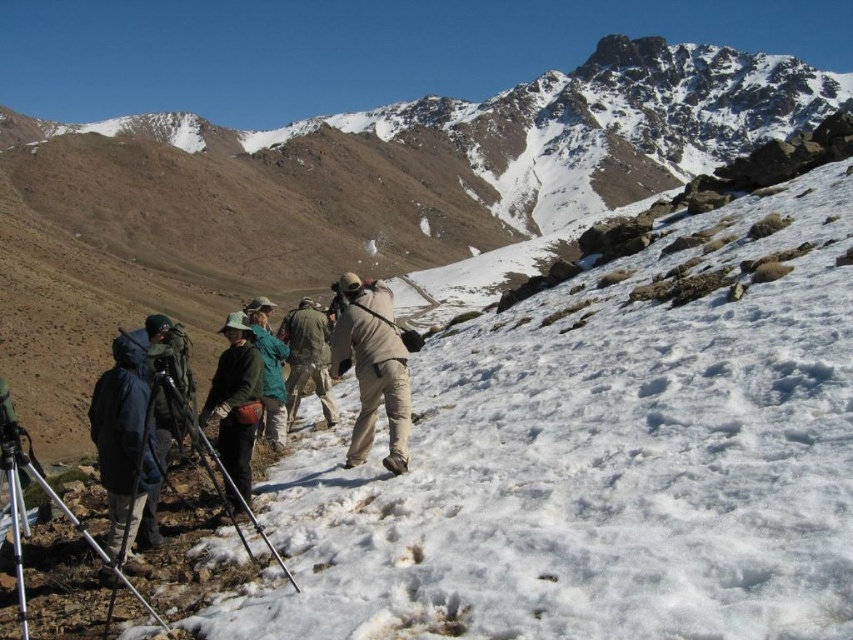
Question: Considering the real-world distances, which object is closest to the tan fabric backpack at center?

Choices:
 (A) silver metallic tripod at lower left
 (B) camouflage fabric jacket at center

Answer: (B)

Question: Does brushed metal backpack at lower left come behind silver metallic tripod at lower left?

Choices:
 (A) yes
 (B) no

Answer: (A)

Question: Can you confirm if brushed metal backpack at lower left is bigger than teal fabric jacket at center?

Choices:
 (A) no
 (B) yes

Answer: (B)

Question: Which is nearer to the silver metallic tripod at lower left?

Choices:
 (A) teal fabric jacket at center
 (B) camouflage fabric jacket at center
 (C) tan fabric backpack at center

Answer: (A)

Question: Which of the following is the farthest from the observer?

Choices:
 (A) (361, 369)
 (B) (15, 513)

Answer: (A)

Question: Is tan fabric backpack at center wider than teal fabric jacket at center?

Choices:
 (A) yes
 (B) no

Answer: (A)